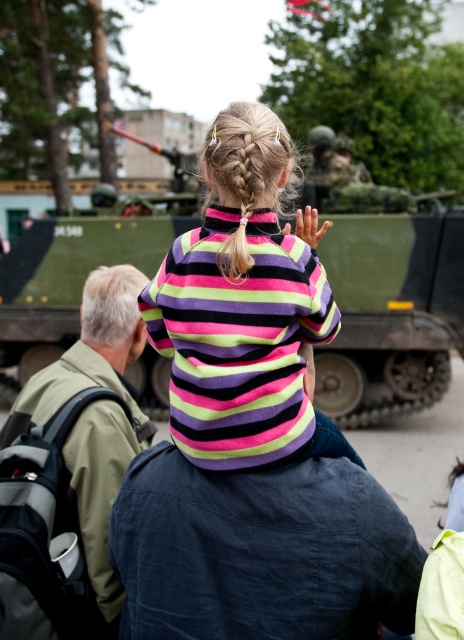
You are standing at the point labeled point (212, 148) and want to walk towards the point labeled point (450, 499). Considering the spatial relationship between these two points, will you be moving closer to or farther away from the camera as you walk?

Since point (212, 148) is closer to the camera than point (450, 499), walking from point (212, 148) towards point (450, 499) means you will be moving farther away from the camera.

You are a photographer trying to capture a clear shot of the green matte tank at center. There is a dark blue fabric shirt at center blocking your view. Can you estimate whether the shirt is wider than the tank, making it harder to see the tank?

The dark blue fabric shirt at center might be wider than green matte tank at center, so there is a possibility that the shirt is blocking the view of the tank.